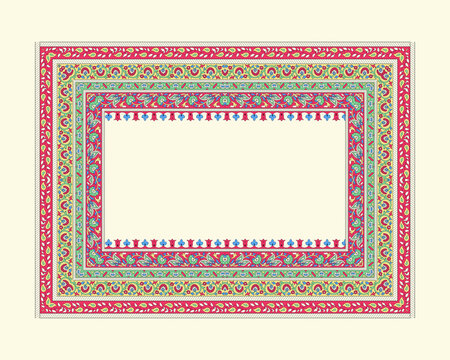
Identify the location of the second border of rug. The width and height of the screenshot is (450, 360). (x=209, y=288).